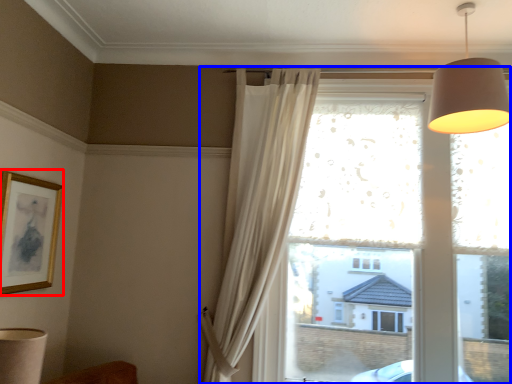
Question: Which object appears closest to the camera in this image, picture frame (highlighted by a red box) or window (highlighted by a blue box)?

Choices:
 (A) picture frame
 (B) window

Answer: (A)